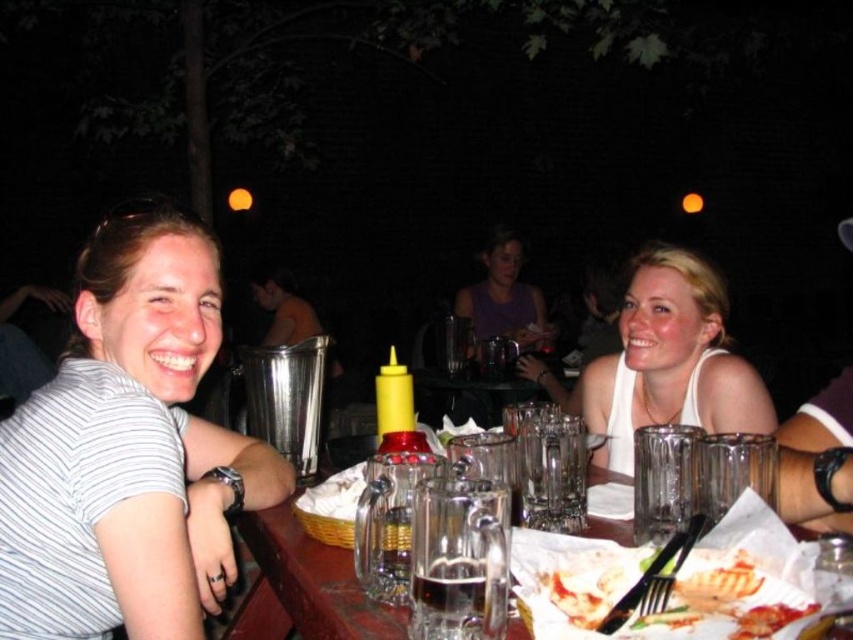
Question: Which object is positioned closest to the translucent glass beer at table center?

Choices:
 (A) white matte tank top at upper right
 (B) white striped shirt at left
 (C) clear glass mug at center

Answer: (C)

Question: Does white matte tank top at upper right appear under clear glass mug at center?

Choices:
 (A) yes
 (B) no

Answer: (B)

Question: Is white striped shirt at left wider than clear glass table at center?

Choices:
 (A) yes
 (B) no

Answer: (B)

Question: Among these points, which one is nearest to the camera?

Choices:
 (A) (476, 515)
 (B) (498, 259)
 (C) (421, 627)

Answer: (A)

Question: Which of the following is the closest to the observer?

Choices:
 (A) clear glass table at center
 (B) white matte tank top at upper right
 (C) clear glass mug at center

Answer: (C)

Question: Is clear glass mug at center in front of translucent glass beer at table center?

Choices:
 (A) no
 (B) yes

Answer: (B)